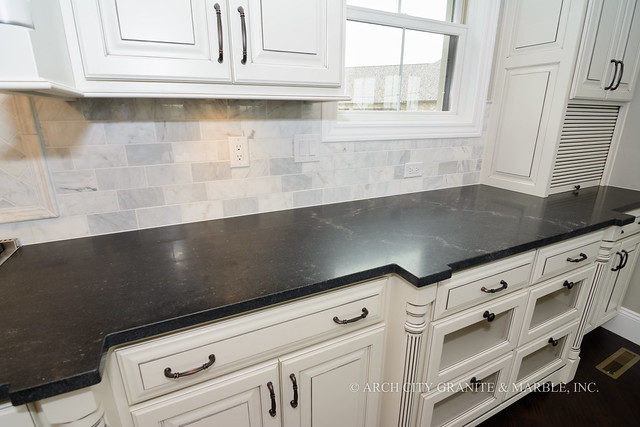
Locate an element on the screen. Image resolution: width=640 pixels, height=427 pixels. black streak on wall is located at coordinates (74, 188), (89, 190).